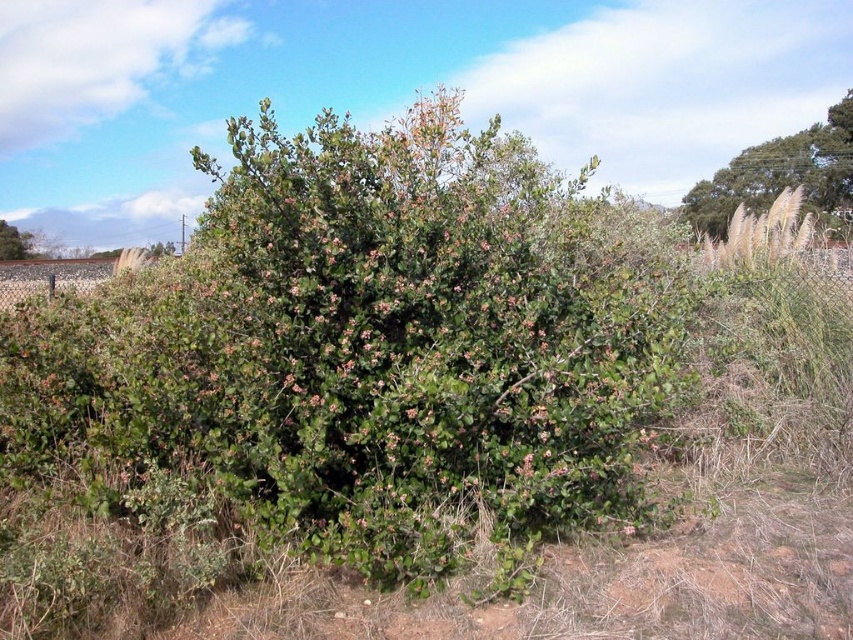
Is green leafy bush at upper right below green leafy bush at left?

Actually, green leafy bush at upper right is above green leafy bush at left.

Does green leafy bush at upper right appear on the left side of green leafy bush at left?

Incorrect, green leafy bush at upper right is not on the left side of green leafy bush at left.

The width and height of the screenshot is (853, 640). Identify the location of green leafy bush at upper right. (782, 176).

This screenshot has width=853, height=640. Identify the location of green leafy bush at upper right. (782, 176).